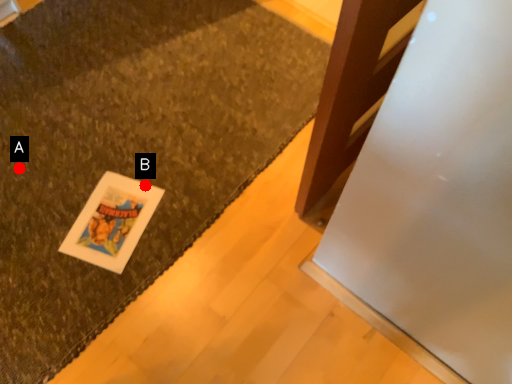
Question: Two points are circled on the image, labeled by A and B beside each circle. Among these points, which one is nearest to the camera?

Choices:
 (A) A is closer
 (B) B is closer

Answer: (B)